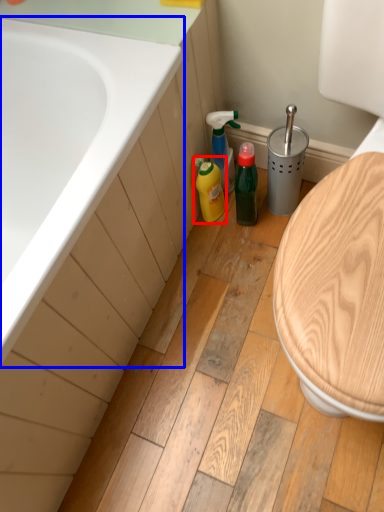
Question: Which object is closer to the camera taking this photo, cleaning product (highlighted by a red box) or bathtub (highlighted by a blue box)?

Choices:
 (A) cleaning product
 (B) bathtub

Answer: (B)